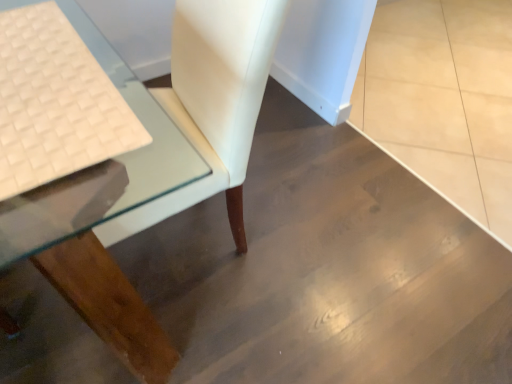
This screenshot has height=384, width=512. I want to click on vacant space underneath clear glass table at lower left (from a real-world perspective), so click(174, 247).